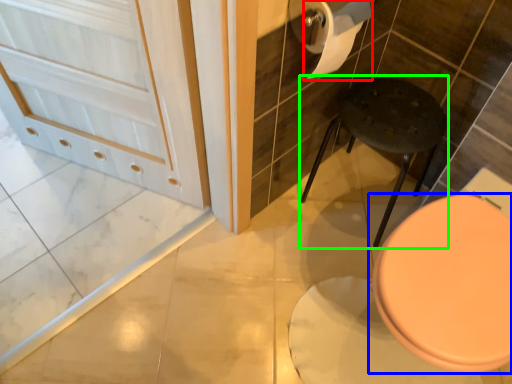
Question: Which object is the closest to the toilet paper (highlighted by a red box)? Choose among these: toilet (highlighted by a blue box) or bar stool (highlighted by a green box).

Choices:
 (A) toilet
 (B) bar stool

Answer: (B)